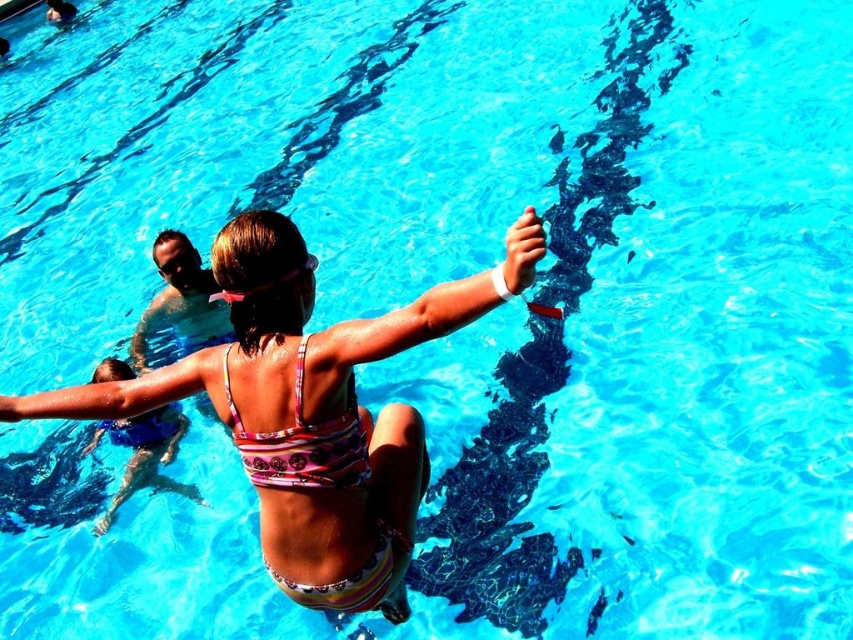
Question: Can you confirm if printed fabric bikini at center is positioned below multicolored striped swimsuit at center?

Choices:
 (A) yes
 (B) no

Answer: (B)

Question: Estimate the real-world distances between objects in this image. Which object is farther from the printed fabric bikini at center?

Choices:
 (A) multicolored striped swimsuit at center
 (B) printed fabric bikini top at center

Answer: (A)

Question: Estimate the real-world distances between objects in this image. Which object is closer to the printed fabric bikini top at center?

Choices:
 (A) multicolored striped swimsuit at center
 (B) pink fabric bikini at center
 (C) printed fabric bikini at center

Answer: (C)

Question: In this image, where is pink fabric bikini at center located relative to multicolored striped swimsuit at center?

Choices:
 (A) right
 (B) left

Answer: (A)

Question: Is pink fabric bikini at center wider than printed fabric bikini at center?

Choices:
 (A) no
 (B) yes

Answer: (B)

Question: Estimate the real-world distances between objects in this image. Which object is farther from the printed fabric bikini at center?

Choices:
 (A) pink fabric bikini at center
 (B) printed fabric bikini top at center

Answer: (A)